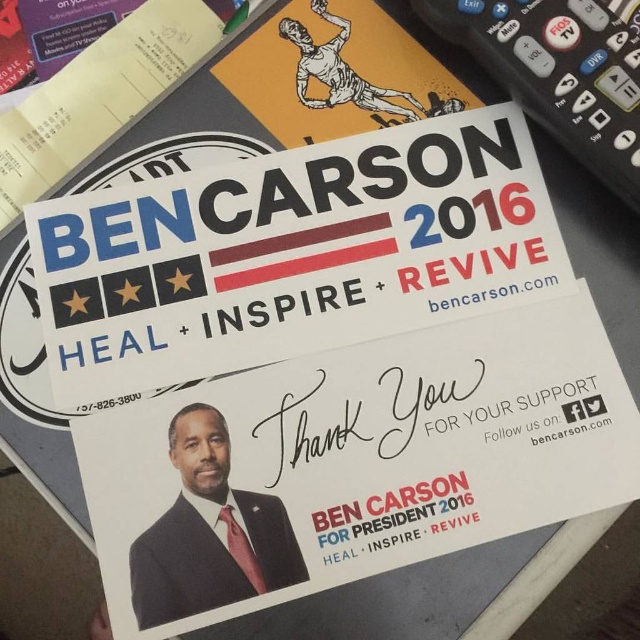
You are a campaign volunteer organizing materials for an event. You have a black plastic remote at upper right and a matte black suit at center. Which object is wider?

The black plastic remote at upper right is wider than the matte black suit at center because its width surpasses the latter.

You are watching a political debate and notice two items in the background of the flyer. The black plastic remote at upper right and the matte black suit at center. Which item is positioned further to the right?

The black plastic remote at upper right is positioned further to the right than the matte black suit at center.

Based on the photo, you are watching a political debate and see the Ben Carson 2016 campaign flyer on the screen. There is a black plastic remote at upper right and a matte black suit at center. Which object is positioned higher on the flyer?

The black plastic remote at upper right is located above the matte black suit at center, so it is positioned higher on the flyer.